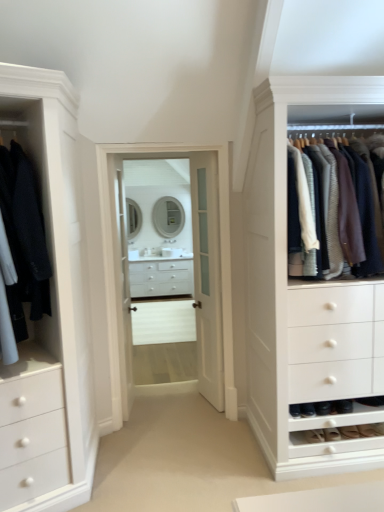
The image size is (384, 512). Identify the location of spots to the right of clear glass door at center, the second glass door viewed from the right. (160, 408).